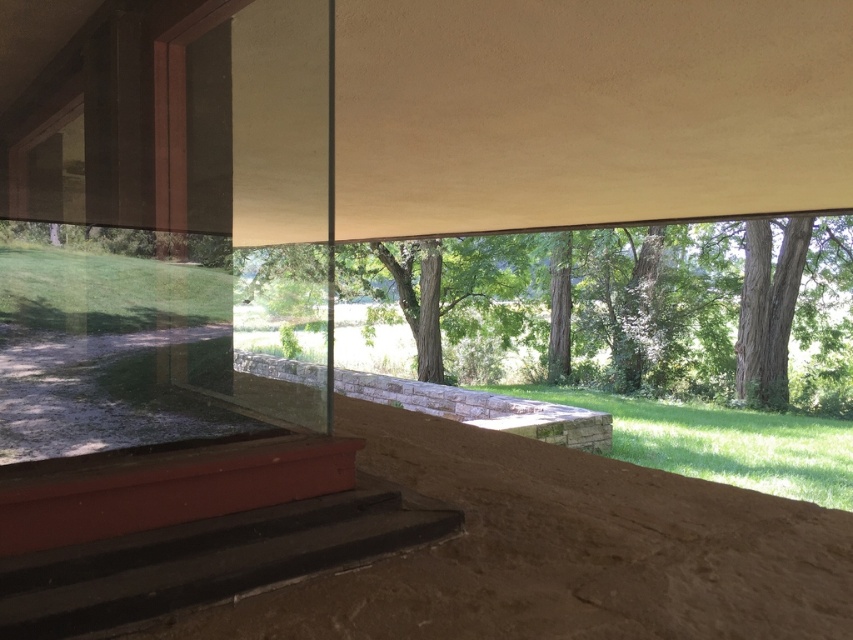
Who is shorter, green leafy tree at center or smooth black stairs at lower left?

With less height is smooth black stairs at lower left.

Locate an element on the screen. The height and width of the screenshot is (640, 853). green leafy tree at center is located at coordinates (624, 307).

Locate an element on the screen. The image size is (853, 640). green leafy tree at center is located at coordinates (624, 307).

Locate an element on the screen. The height and width of the screenshot is (640, 853). green leafy tree at center is located at coordinates (624, 307).